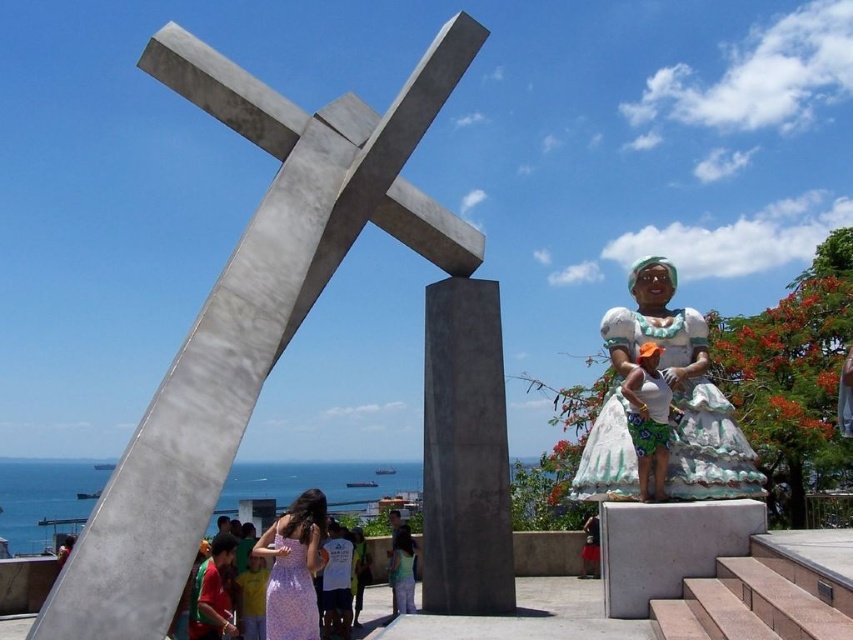
You are an artist planning to paint the scene. You need to decide which object to focus on first based on their sizes. Which object should you paint first, the white fabric statue at right or the purple floral dress at center?

The white fabric statue at right is larger in size than the purple floral dress at center, so you should paint the white fabric statue at right first as it requires more attention due to its larger size.

You are a photographer planning to capture a wide shot of the sculpture and the statues. You need to ensure both the purple floral dress at center and the green floral skirt at right are fully visible in the frame. Given their sizes, which object requires you to adjust your camera angle to accommodate its width?

The purple floral dress at center requires adjusting the camera angle because its width is larger than the green floral skirt at right, so it needs more space in the frame to be fully visible.

You are standing at the base of the polished concrete cross at center and want to see the green floral skirt at right. Which direction should you look to see it?

The polished concrete cross at center is above the green floral skirt at right, so you should look downward to see it.